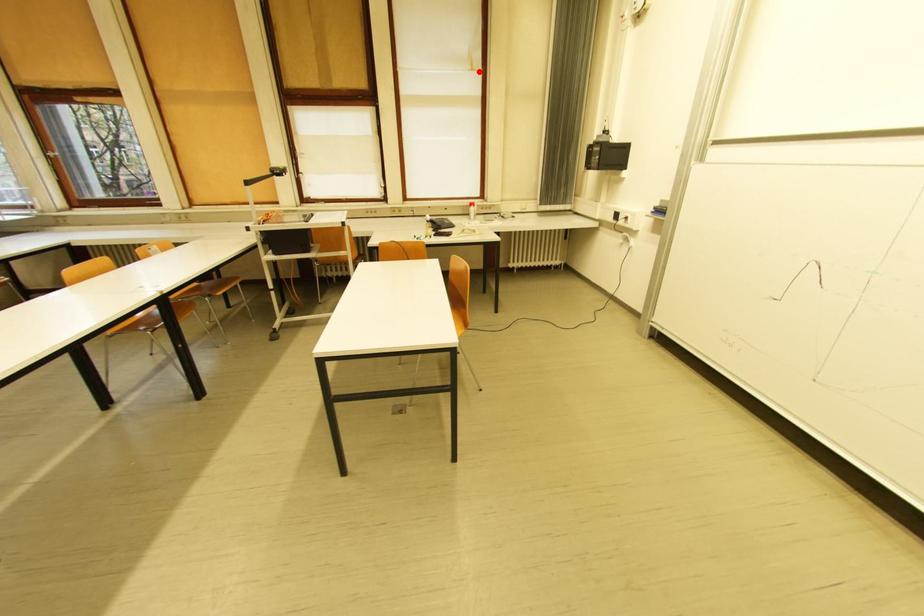
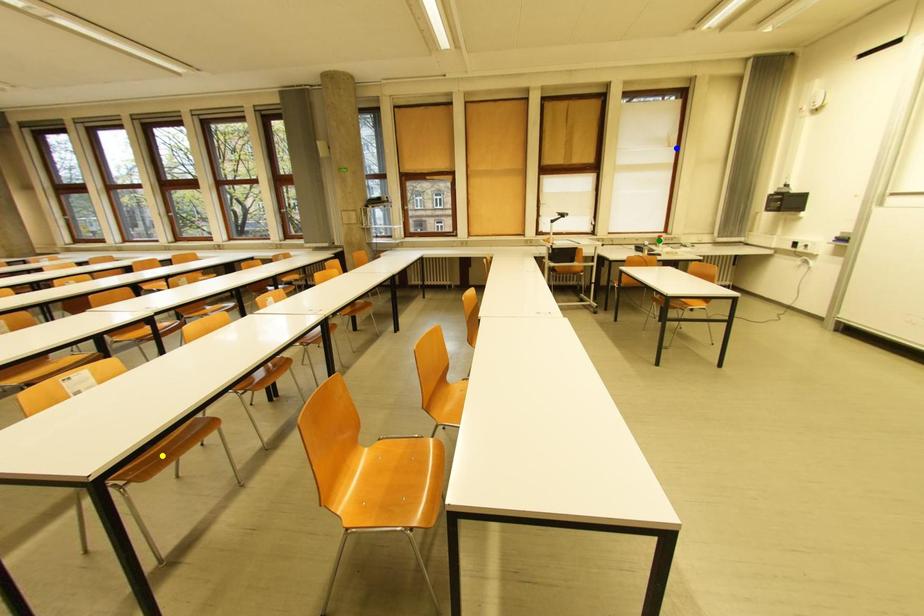
Question: I am providing you with two images of the same scene from different viewpoints. A red point is marked on the first image. You are given multiple points on the second image. Which point in image 2 represents the same 3d spot as the red point in image 1?

Choices:
 (A) yellow point
 (B) green point
 (C) blue point

Answer: (C)